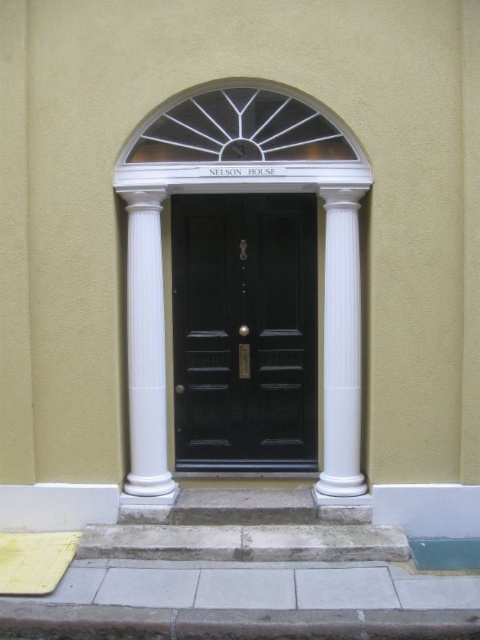
Question: Among these objects, which one is farthest from the camera?

Choices:
 (A) white glossy column at center
 (B) matte black door at center

Answer: (B)

Question: Which point is closer to the camera?

Choices:
 (A) (153, 204)
 (B) (337, 412)
 (C) (225, 330)

Answer: (A)

Question: Does white glossy column at center appear under white smooth column at center?

Choices:
 (A) no
 (B) yes

Answer: (B)

Question: Does matte black door at center appear over white smooth column at center?

Choices:
 (A) no
 (B) yes

Answer: (B)

Question: Which point is closer to the camera?

Choices:
 (A) (180, 209)
 (B) (146, 413)
 (C) (342, 369)

Answer: (C)

Question: Is matte black door at center to the left of white glossy column at center from the viewer's perspective?

Choices:
 (A) no
 (B) yes

Answer: (A)